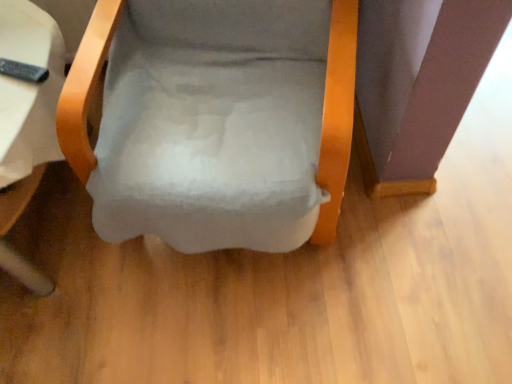
Image resolution: width=512 pixels, height=384 pixels. In order to click on vacant area that lies in front of suede-like gray chair at center in this screenshot , I will do `click(272, 327)`.